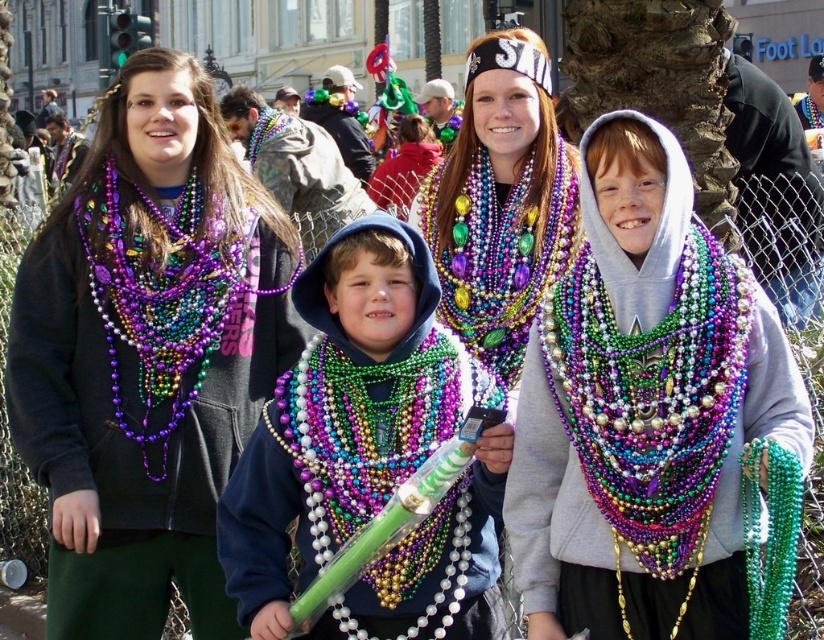
What object is located at the coordinates point (653, 417) in the image?

The point (653, 417) corresponds to the multicolored beaded necklace at center.